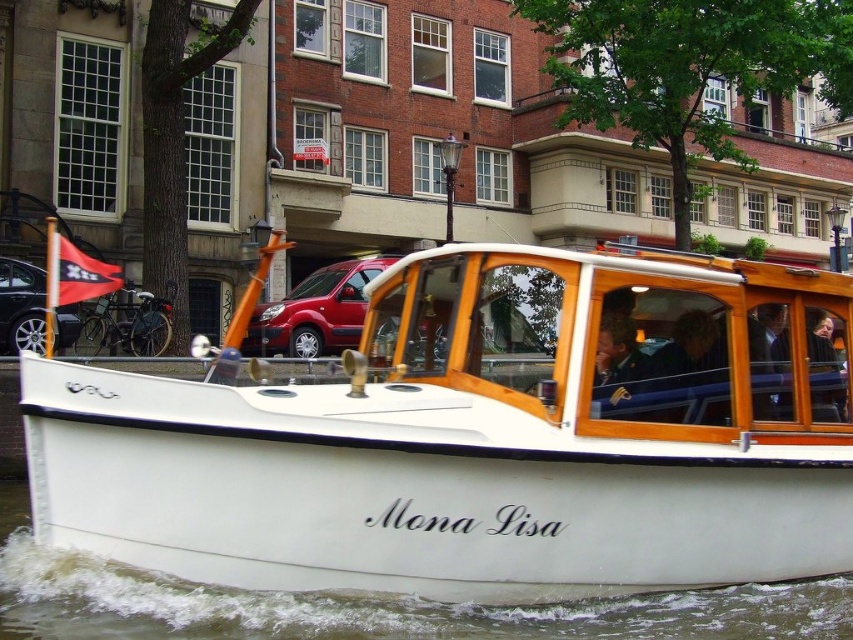
You are standing on a bridge overlooking the canal and want to take a photo of the white polished wood boat at center. The camera you have can focus on objects up to 6 meters away. Will the boat be in focus?

The white polished wood boat at center is 5.91 meters from camera, so it is within the camera focus range of 6 meters. The boat will be in focus.

Consider the image. You are standing on a bridge overlooking the canal and see the white polished wood boat at center and the white water at lower center. Which object is closer to you?

The white polished wood boat at center is closer to you because it is positioned further to the viewer than the white water at lower center.